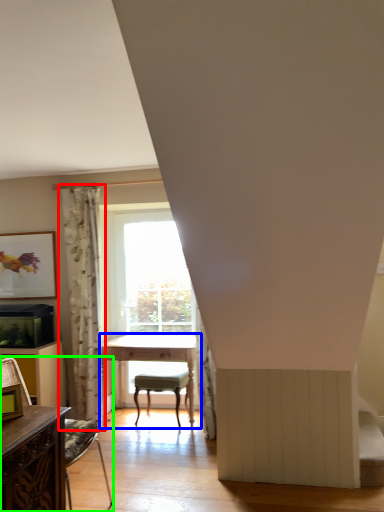
Question: Based on their relative distances, which object is farther from curtain (highlighted by a red box)? Choose from table (highlighted by a blue box) and chair (highlighted by a green box).

Choices:
 (A) table
 (B) chair

Answer: (B)